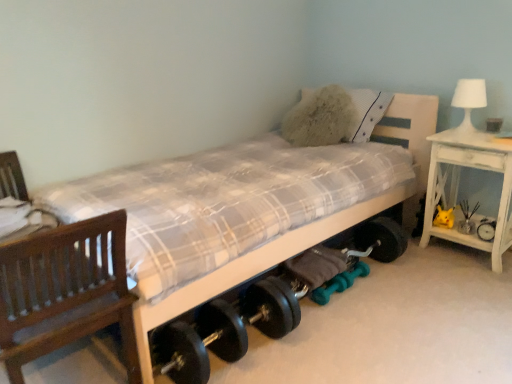
The width and height of the screenshot is (512, 384). I want to click on vacant area in front of teal rubber dumbbell at lower center, marked as the first dumbbell in a left-to-right arrangement, so click(x=334, y=318).